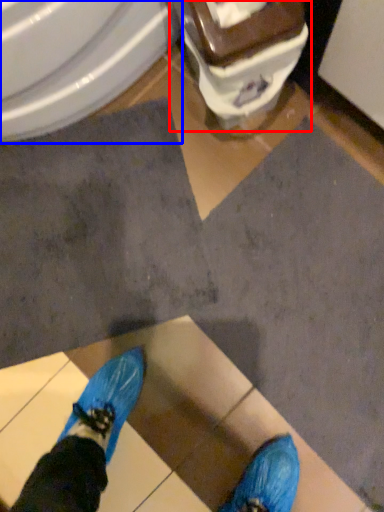
Question: Which point is closer to the camera, toilet (highlighted by a red box) or bidet (highlighted by a blue box)?

Choices:
 (A) toilet
 (B) bidet

Answer: (A)